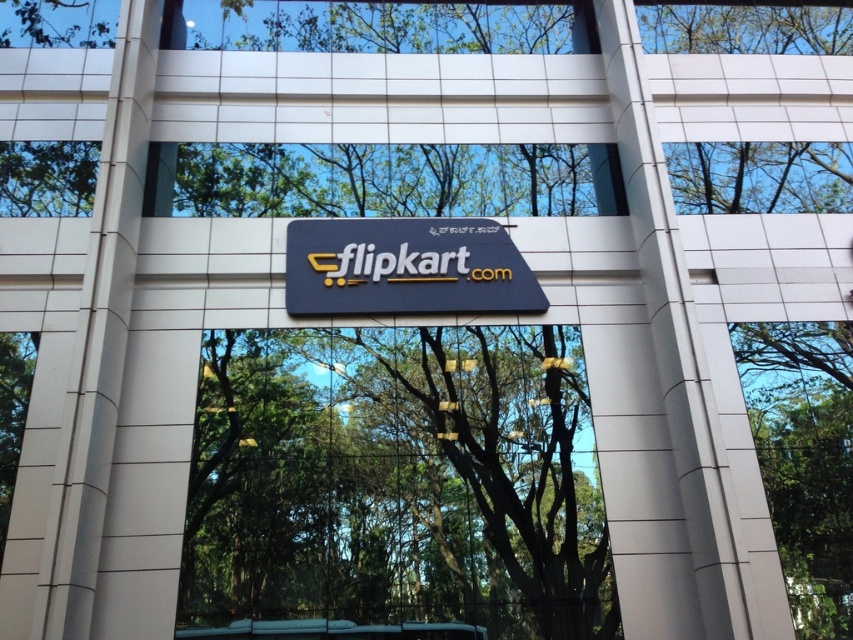
Question: Which object appears closest to the camera in this image?

Choices:
 (A) matte black sign at center
 (B) green leafy tree at center

Answer: (B)

Question: Which of the following is the farthest from the observer?

Choices:
 (A) (294, 417)
 (B) (308, 266)

Answer: (B)

Question: Does green leafy tree at center have a greater width compared to matte black sign at center?

Choices:
 (A) no
 (B) yes

Answer: (B)

Question: Is green leafy tree at center thinner than matte black sign at center?

Choices:
 (A) yes
 (B) no

Answer: (B)

Question: Observing the image, what is the correct spatial positioning of green leafy tree at center in reference to matte black sign at center?

Choices:
 (A) left
 (B) right

Answer: (A)